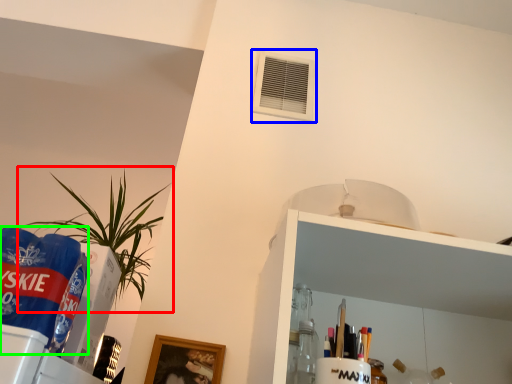
Question: Estimate the real-world distances between objects in this image. Which object is farther from houseplant (highlighted by a red box), air conditioning (highlighted by a blue box) or beverage (highlighted by a green box)?

Choices:
 (A) air conditioning
 (B) beverage

Answer: (B)